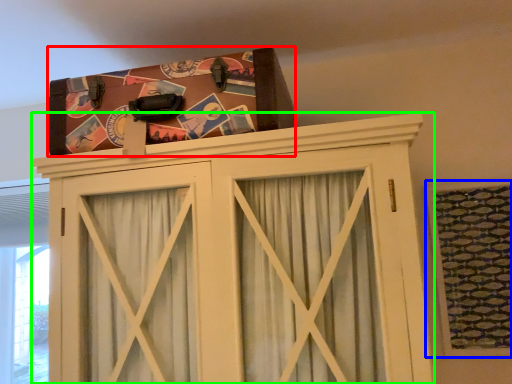
Question: Considering the real-world distances, which object is farthest from package (highlighted by a red box)? window (highlighted by a blue box) or cupboard (highlighted by a green box)?

Choices:
 (A) window
 (B) cupboard

Answer: (A)